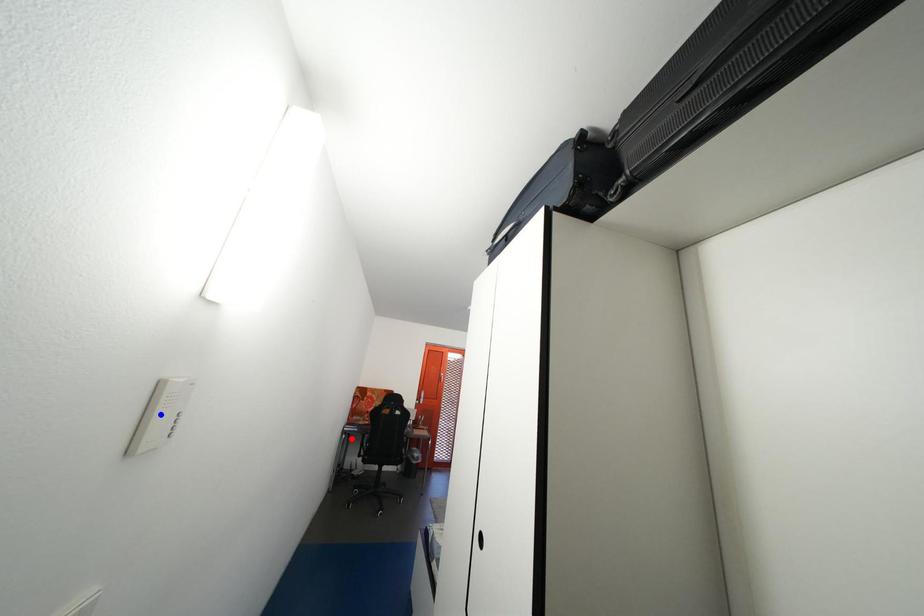
Question: Which of the two points in the image is closer to the camera?

Choices:
 (A) Blue point is closer.
 (B) Red point is closer.

Answer: (A)